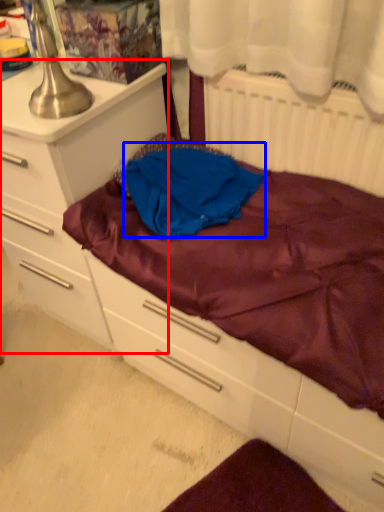
Question: Which object is closer to the camera taking this photo, chest of drawers (highlighted by a red box) or clothing (highlighted by a blue box)?

Choices:
 (A) chest of drawers
 (B) clothing

Answer: (A)